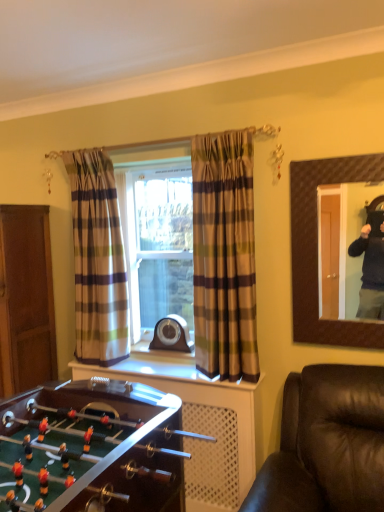
Question: Is brown plaid curtain at center, the first curtain when ordered from front to back, completely or partially inside brown textured mirror at upper right?

Choices:
 (A) yes
 (B) no

Answer: (B)

Question: From a real-world perspective, is brown textured mirror at upper right located higher than brown plaid curtain at center, acting as the 1th curtain starting from the right?

Choices:
 (A) no
 (B) yes

Answer: (B)

Question: Is brown textured mirror at upper right facing towards brown plaid curtain at center, the first curtain when ordered from front to back?

Choices:
 (A) no
 (B) yes

Answer: (A)

Question: Are brown textured mirror at upper right and brown plaid curtain at center, the first curtain when ordered from front to back, making contact?

Choices:
 (A) yes
 (B) no

Answer: (B)

Question: Is brown textured mirror at upper right looking in the opposite direction of brown plaid curtain at center, which appears as the second curtain when viewed from the left?

Choices:
 (A) yes
 (B) no

Answer: (B)

Question: Is brown textured mirror at upper right shorter than brown plaid curtain at center, the first curtain when ordered from front to back?

Choices:
 (A) yes
 (B) no

Answer: (A)

Question: Is plaid fabric curtain at left, which is the 2th curtain from front to back, further to the viewer compared to brown wooden dresser at lower left?

Choices:
 (A) no
 (B) yes

Answer: (B)

Question: From the image's perspective, would you say plaid fabric curtain at left, acting as the 1th curtain starting from the back, is shown under brown wooden dresser at lower left?

Choices:
 (A) yes
 (B) no

Answer: (B)

Question: Is plaid fabric curtain at left, acting as the 2th curtain starting from the right, bigger than brown wooden dresser at lower left?

Choices:
 (A) yes
 (B) no

Answer: (B)

Question: Is plaid fabric curtain at left, acting as the 1th curtain starting from the back, taller than brown wooden dresser at lower left?

Choices:
 (A) yes
 (B) no

Answer: (A)

Question: Could you tell me if plaid fabric curtain at left, marked as the first curtain in a left-to-right arrangement, is turned towards brown wooden dresser at lower left?

Choices:
 (A) yes
 (B) no

Answer: (A)

Question: Considering the relative sizes of plaid fabric curtain at left, acting as the 1th curtain starting from the back, and brown wooden dresser at lower left in the image provided, is plaid fabric curtain at left, acting as the 1th curtain starting from the back, shorter than brown wooden dresser at lower left?

Choices:
 (A) yes
 (B) no

Answer: (B)

Question: Does plaid fabric curtain at left, marked as the first curtain in a left-to-right arrangement, contain brown wooden door at left?

Choices:
 (A) yes
 (B) no

Answer: (B)